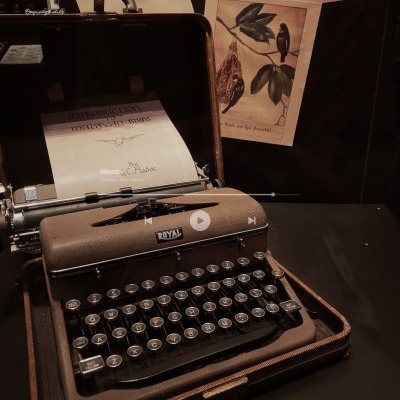
Find the location of a particular element. The width and height of the screenshot is (400, 400). v key on the typewriter is located at coordinates (172, 338).